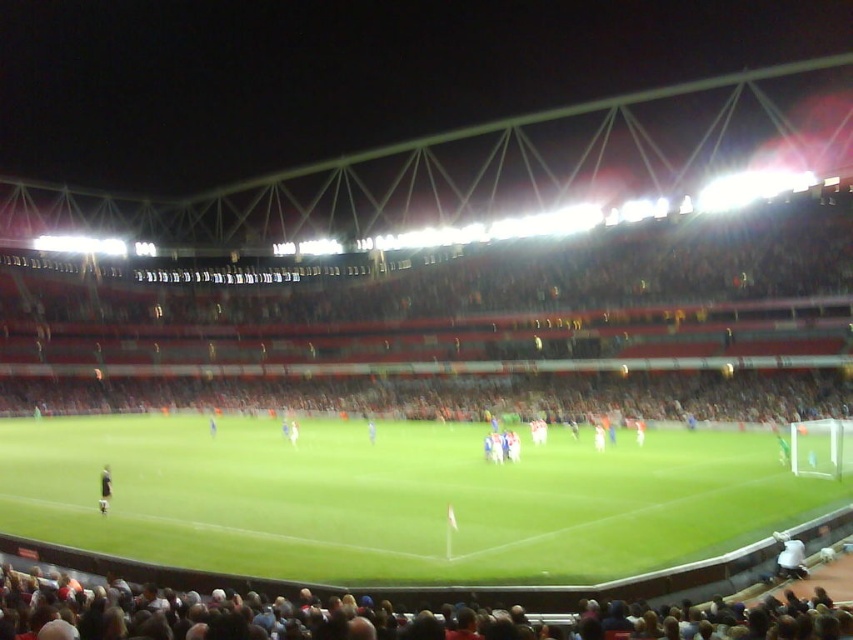
Looking at this image, you are a photographer standing at the edge of the field. You want to take a photo that includes both the green grass football field at center and the white fabric person at center. Based on their positions, which object should be placed on the left side of the photo to ensure both are visible?

The white fabric person at center should be placed on the left side of the photo because the green grass football field at center is positioned on the right side of the white fabric person at center, so placing the person on the left allows both to be included in the frame.

You are a photographer trying to capture a closeup of the dark brown hair at lower center without including the white fabric at lower right in the frame. Based on their positions, is this possible?

The dark brown hair at lower center is positioned over the white fabric at lower right, so it would be challenging to capture the dark brown hair at lower center without including the white fabric at lower right in the frame since they are stacked vertically.

You are a photographer standing at the edge of the soccer field. You want to capture a closeup shot of the dark brown hair at lower center. Given that your telephoto lens can focus on objects up to 10 meters away, will you be able to take the photo clearly?

The dark brown hair at lower center is 12.26 meters away from the viewer. Since the telephoto lens can only focus up to 10 meters, it will not be able to capture the dark brown hair at lower center clearly.